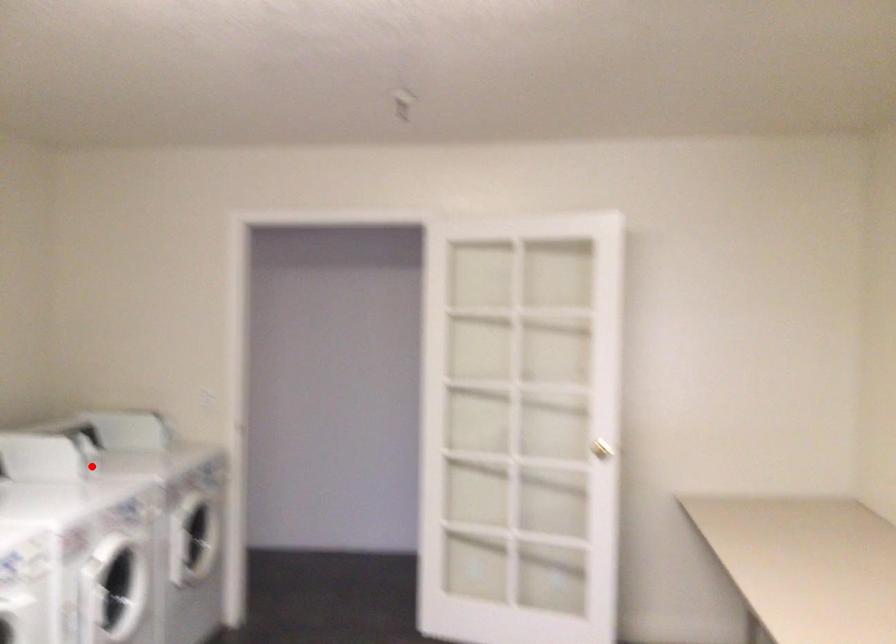
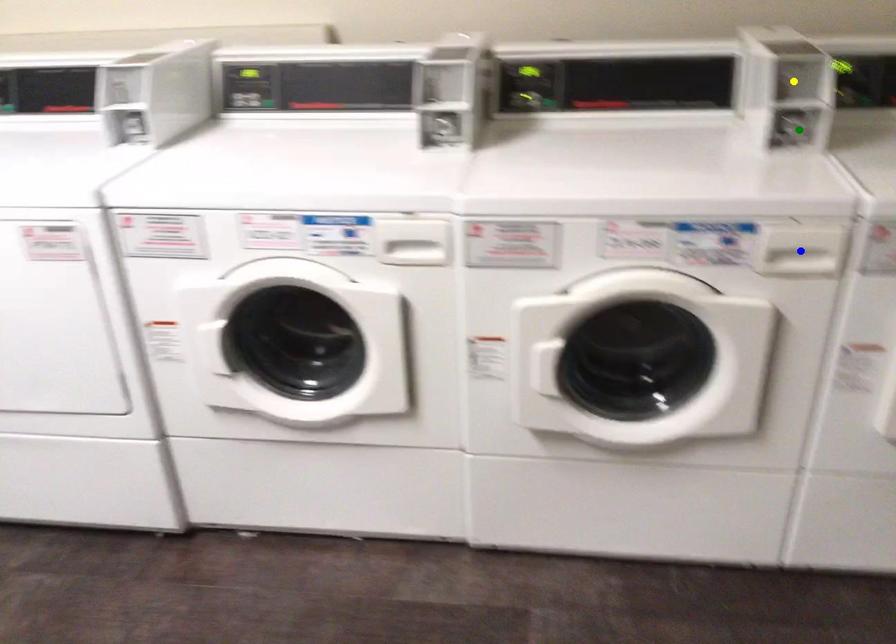
Question: I am providing you with two images of the same scene from different viewpoints. A red point is marked on the first image. You are given multiple points on the second image. Which spot in image 2 lines up with the point in image 1?

Choices:
 (A) green point
 (B) yellow point
 (C) blue point

Answer: (A)